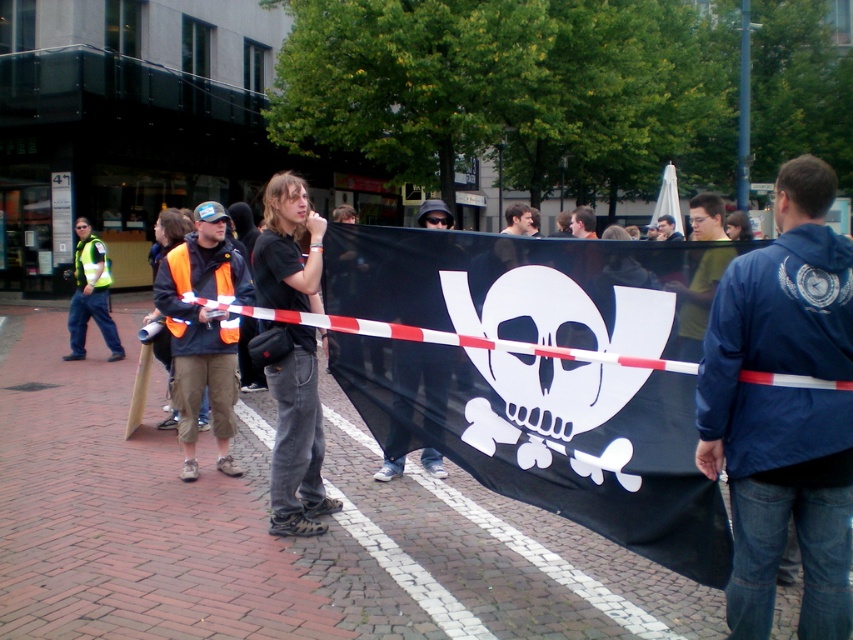
Describe the element at coordinates (784, 410) in the screenshot. The image size is (853, 640). I see `blue fabric jacket at center` at that location.

Consider the image. Does blue fabric jacket at center appear on the left side of matte black shirt at center?

Correct, you'll find blue fabric jacket at center to the left of matte black shirt at center.

Identify the location of blue fabric jacket at center. (784, 410).

Who is positioned more to the left, black fabric banner at center or yellow-green t-shirt at center?

From the viewer's perspective, black fabric banner at center appears more on the left side.

Is black fabric banner at center smaller than yellow-green t-shirt at center?

Actually, black fabric banner at center might be larger than yellow-green t-shirt at center.

Which is behind, point (544, 433) or point (709, 230)?

The point (709, 230) is more distant.

Find the location of a particular element. This screenshot has width=853, height=640. black fabric banner at center is located at coordinates (552, 438).

Consider the image. Does blue fabric jacket at center appear on the right side of black matte shirt at center?

Indeed, blue fabric jacket at center is positioned on the right side of black matte shirt at center.

Which is more to the right, blue fabric jacket at center or black matte shirt at center?

From the viewer's perspective, blue fabric jacket at center appears more on the right side.

Does point (834, 636) lie in front of point (282, 273)?

Yes, it is in front of point (282, 273).

This screenshot has width=853, height=640. I want to click on blue fabric jacket at center, so click(x=784, y=410).